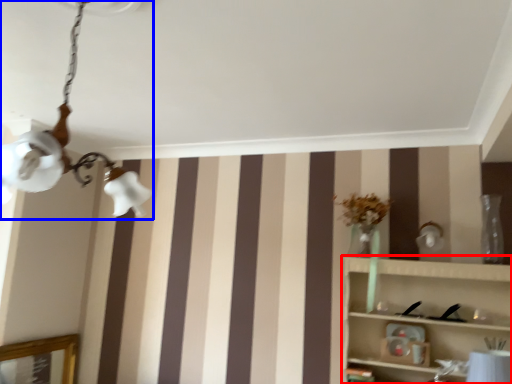
Question: Which object appears closest to the camera in this image, shelf (highlighted by a red box) or lamp (highlighted by a blue box)?

Choices:
 (A) shelf
 (B) lamp

Answer: (B)